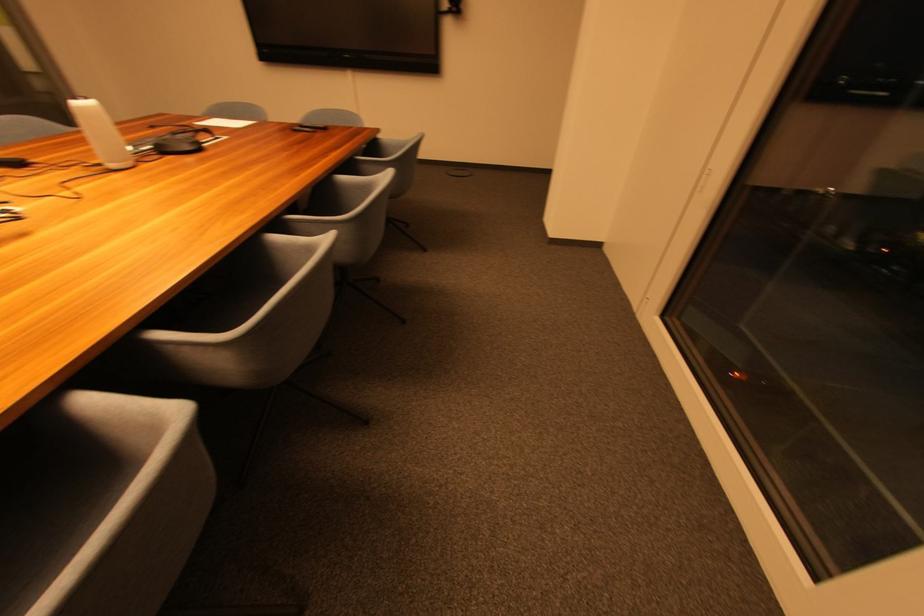
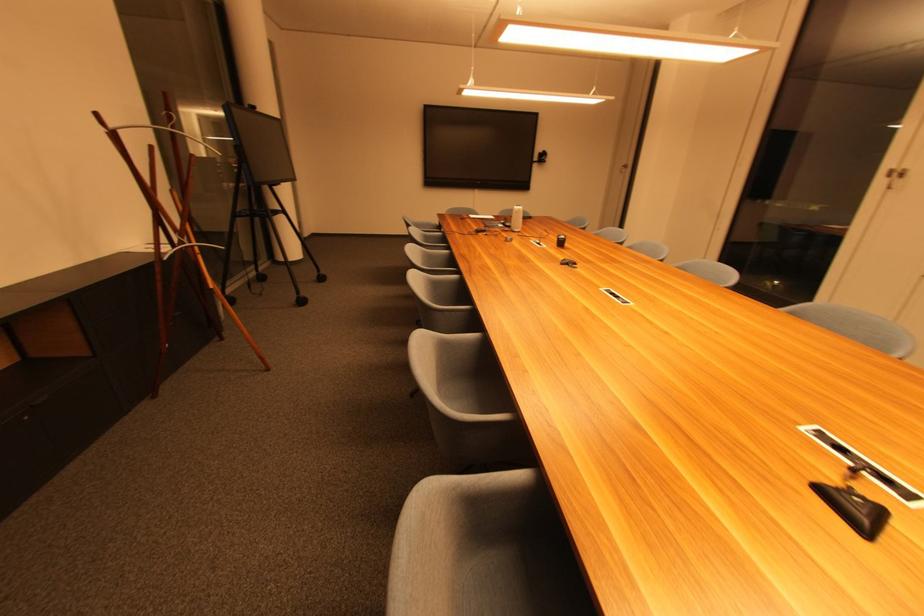
Which direction would the cameraman need to move to produce the second image?

The cameraman moved toward left, backward.